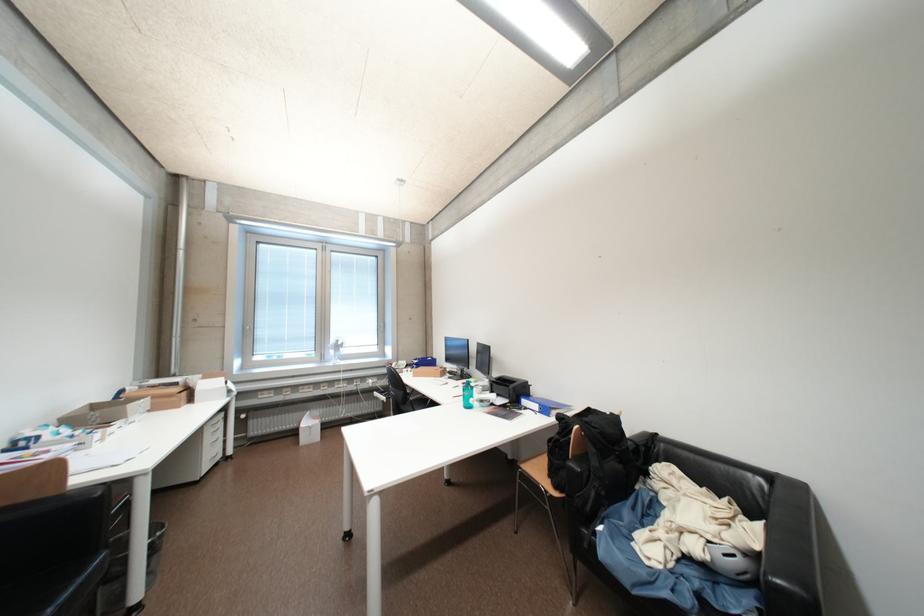
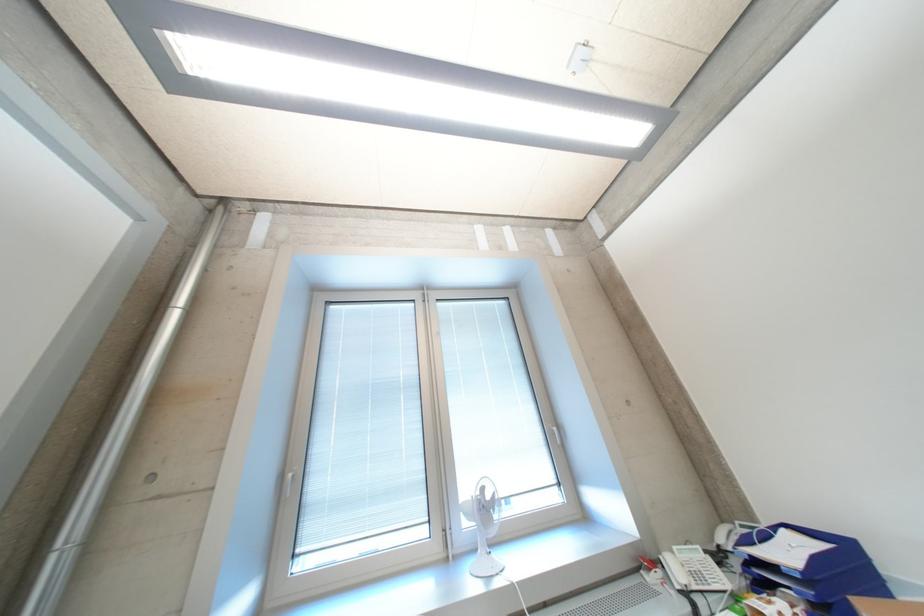
In the second image, find the point that corresponds to point (423, 362) in the first image.

(757, 543)